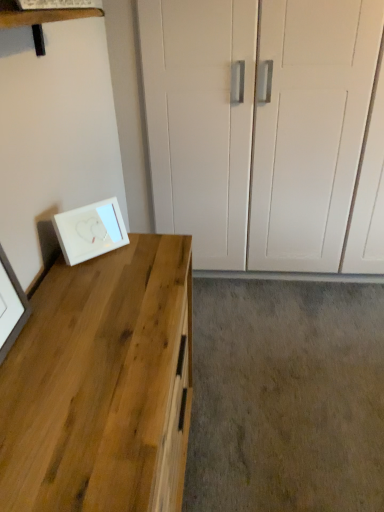
Where is `free location above natural wood desk at left (from a real-world perspective)`? free location above natural wood desk at left (from a real-world perspective) is located at coordinates (72, 348).